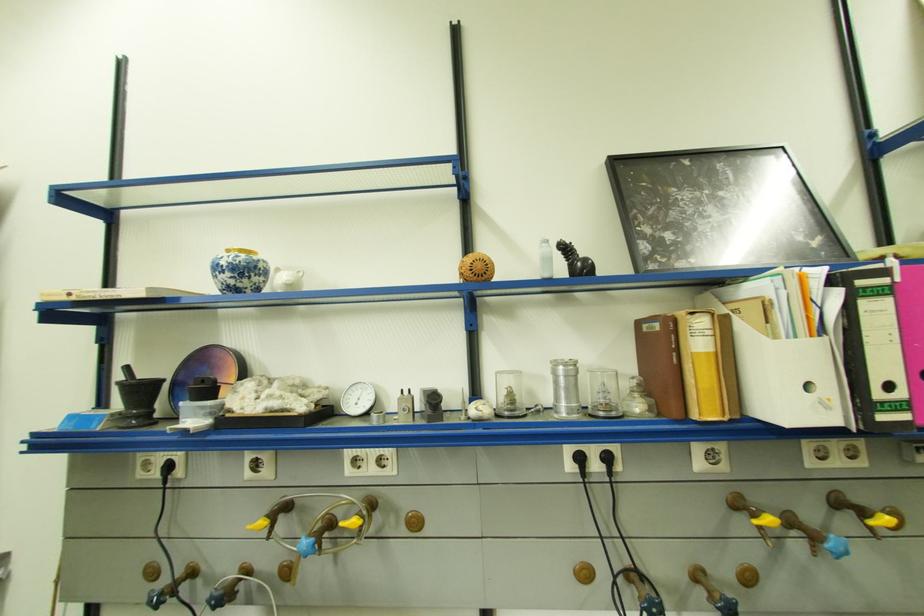
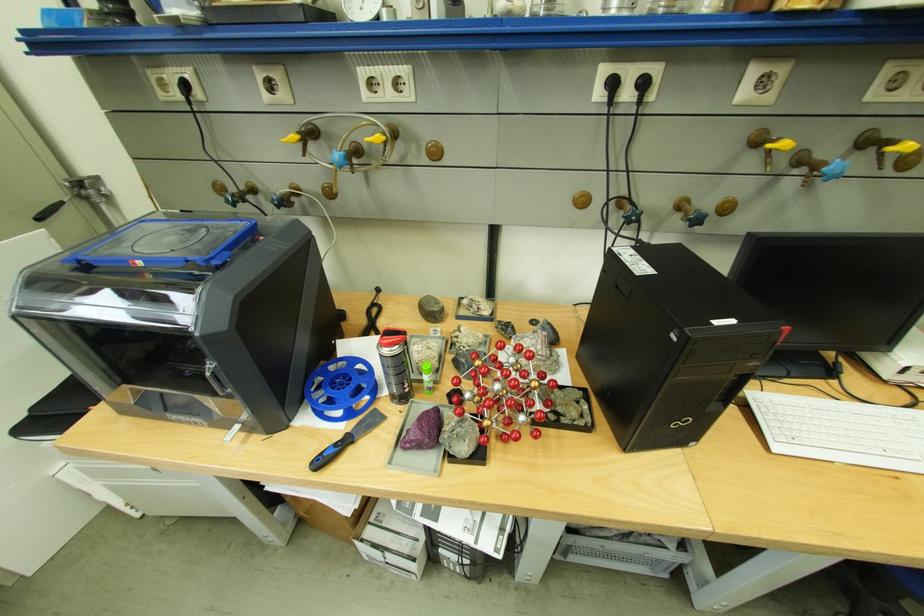
In the second image, find the point that corresponds to the point at 584,458 in the first image.

(615, 84)